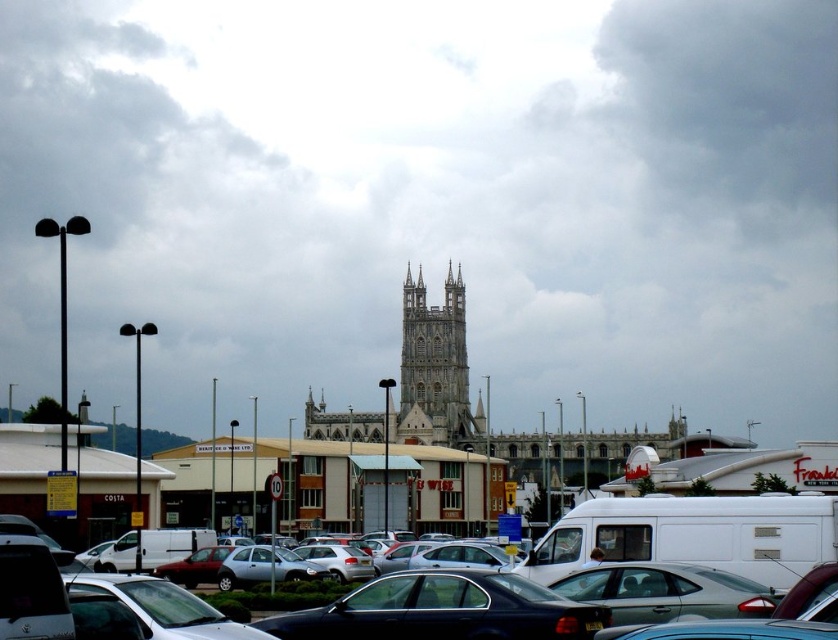
You are a delivery driver who needs to park your truck in the parking lot near the historic building. Your truck is 10 meters long. Can you safely park your truck between the silver metallic sedan at center and the white stone tower at center without overlapping either?

The distance between the silver metallic sedan at center and the white stone tower at center is 33.64 meters. Since your truck is only 10 meters long, there is sufficient space to park it between them without overlapping either object.

Based on the photo, you are a delivery driver who needs to park your truck in this parking lot. You see the silver metallic sedan at center and the white stone tower at center. Which vehicle can you park next to without worrying about blocking the entrance?

The silver metallic sedan at center has a larger size compared to white stone tower at center, so you should park next to the white stone tower at center to avoid blocking the entrance.